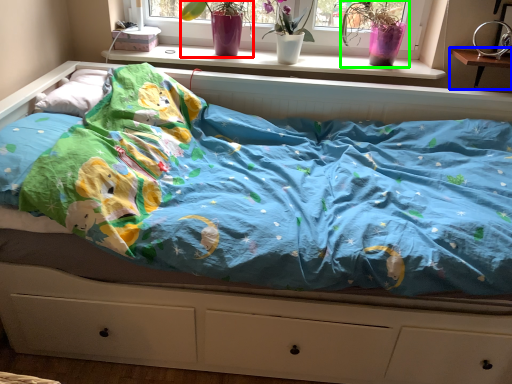
Question: Considering the real-world distances, which object is closest to floral arrangement (highlighted by a red box)? changing table (highlighted by a blue box) or floral arrangement (highlighted by a green box).

Choices:
 (A) changing table
 (B) floral arrangement

Answer: (B)